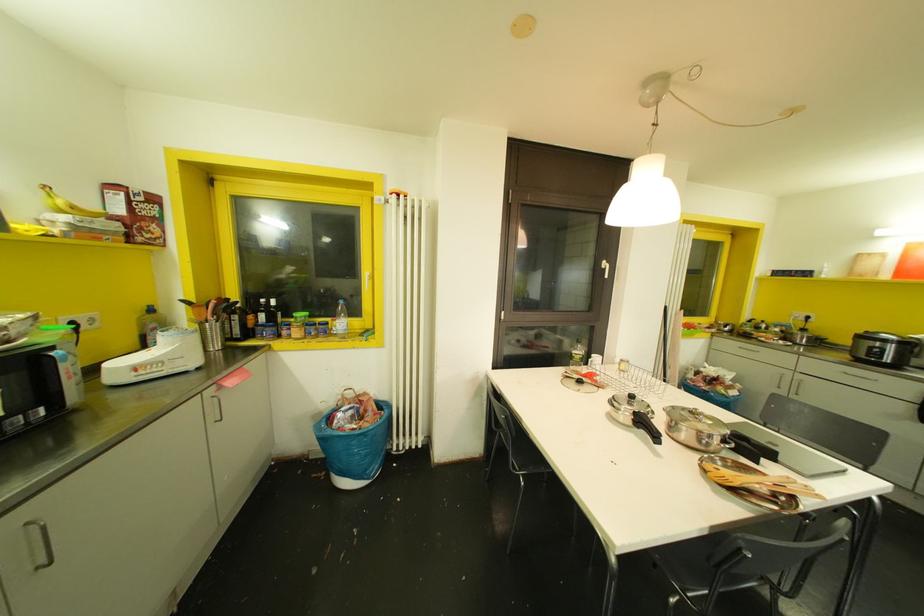
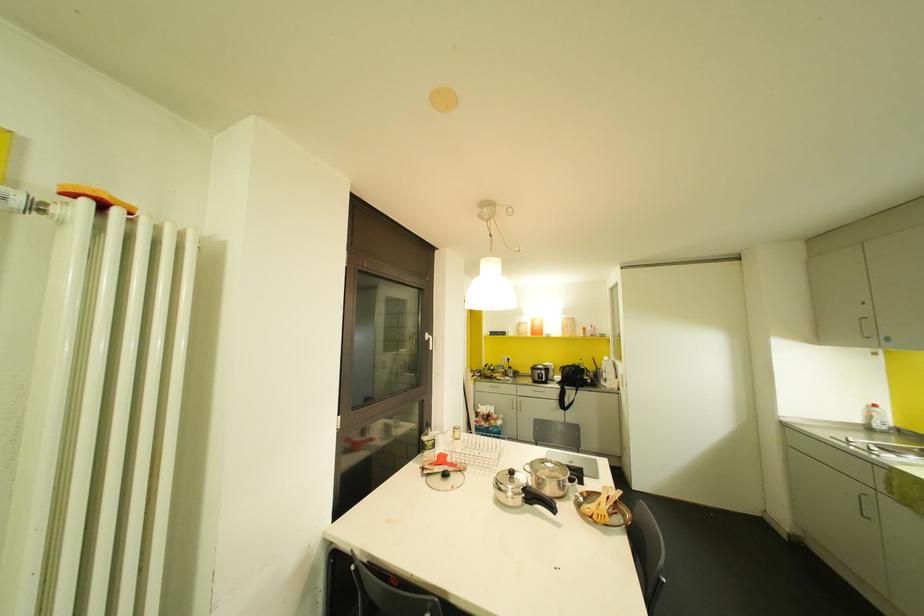
Locate, in the second image, the point that corresponds to [605,276] in the first image.

(430, 347)